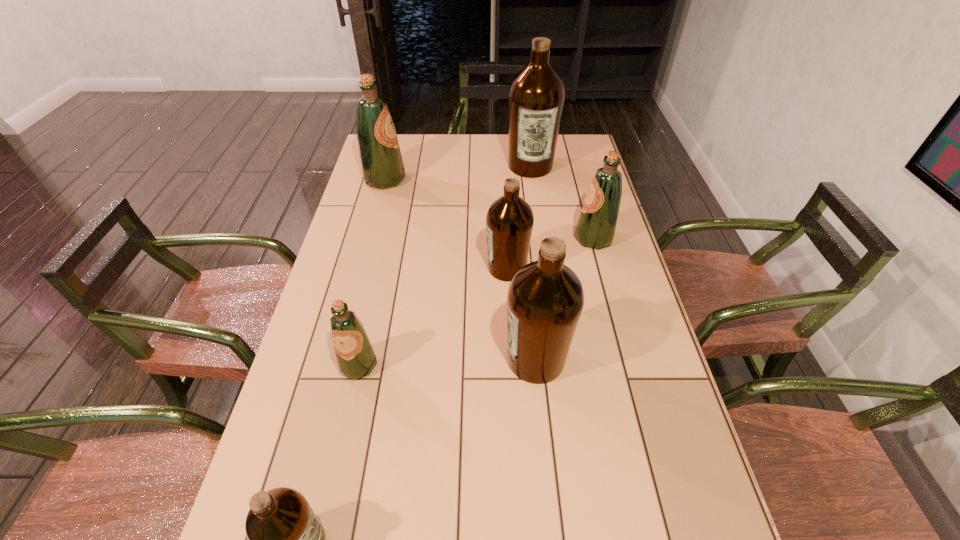
The height and width of the screenshot is (540, 960). What are the coordinates of `free space located 0.290m on the front-facing side of the farthest green olive oil` in the screenshot? It's located at (485, 180).

What are the coordinates of `vacant space located 0.370m on the label of the third smallest brown olive oil` in the screenshot? It's located at (352, 359).

I want to click on free region located 0.390m on the label of the third smallest brown olive oil, so click(x=344, y=359).

You are a GUI agent. You are given a task and a screenshot of the screen. Output one action in this format:
    pyautogui.click(x=<x>, y=<y>)
    Task: Click on the free space located 0.090m on the label of the third smallest brown olive oil
    This screenshot has width=960, height=540.
    Given the screenshot: What is the action you would take?
    pyautogui.click(x=467, y=359)

The width and height of the screenshot is (960, 540). In order to click on free location located 0.300m on the front-facing side of the rightmost olive oil in this screenshot , I will do `click(479, 239)`.

Identify the location of vacant space located 0.230m on the front-facing side of the rightmost olive oil. The height and width of the screenshot is (540, 960). (501, 239).

In order to click on vacant space located on the front-facing side of the rightmost olive oil in this screenshot , I will do `click(552, 239)`.

I want to click on vacant region located 0.160m on the label of the third biggest brown olive oil, so click(x=431, y=268).

This screenshot has width=960, height=540. I want to click on free space located on the label of the third biggest brown olive oil, so click(x=434, y=268).

Find the location of `blank space located on the label of the third biggest brown olive oil`. blank space located on the label of the third biggest brown olive oil is located at coordinates (390, 268).